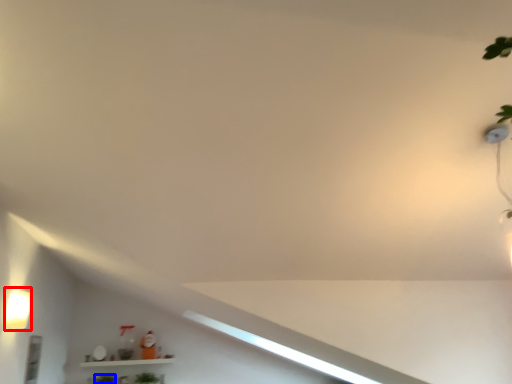
Question: Among these objects, which one is farthest to the camera, light fixture (highlighted by a red box) or plant (highlighted by a blue box)?

Choices:
 (A) light fixture
 (B) plant

Answer: (B)